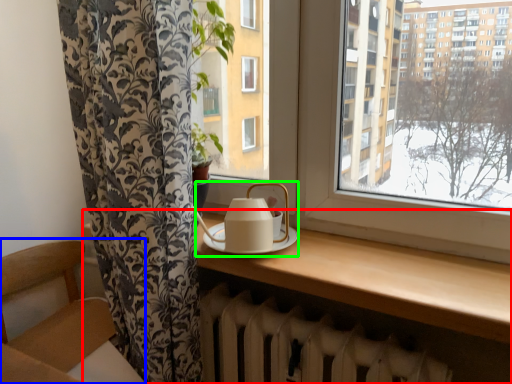
Question: Which object is the farthest from table (highlighted by a red box)? Choose among these: armchair (highlighted by a blue box) or tea set (highlighted by a green box).

Choices:
 (A) armchair
 (B) tea set

Answer: (A)